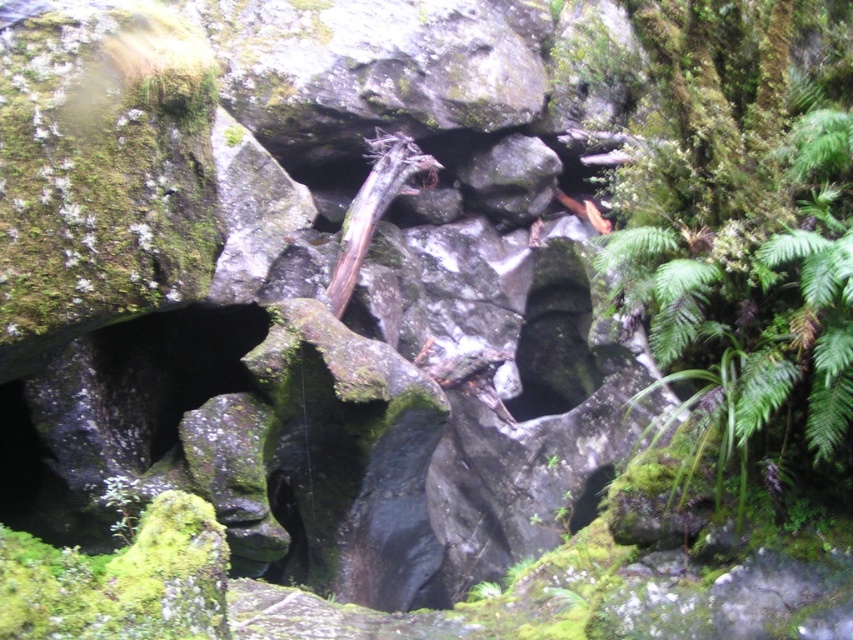
Question: From the image, what is the correct spatial relationship of green mossy plant at right in relation to brown rough tree trunk at center?

Choices:
 (A) right
 (B) left

Answer: (A)

Question: Does green mossy plant at right lie behind brown rough tree trunk at center?

Choices:
 (A) no
 (B) yes

Answer: (A)

Question: Where is green mossy plant at right located in relation to brown rough tree trunk at center in the image?

Choices:
 (A) right
 (B) left

Answer: (A)

Question: Which of the following is the closest to the observer?

Choices:
 (A) brown rough tree trunk at center
 (B) green mossy plant at right

Answer: (B)

Question: Which point is farther to the camera?

Choices:
 (A) green mossy plant at right
 (B) brown rough tree trunk at center

Answer: (B)

Question: Which point is closer to the camera?

Choices:
 (A) brown rough tree trunk at center
 (B) green mossy plant at right

Answer: (B)